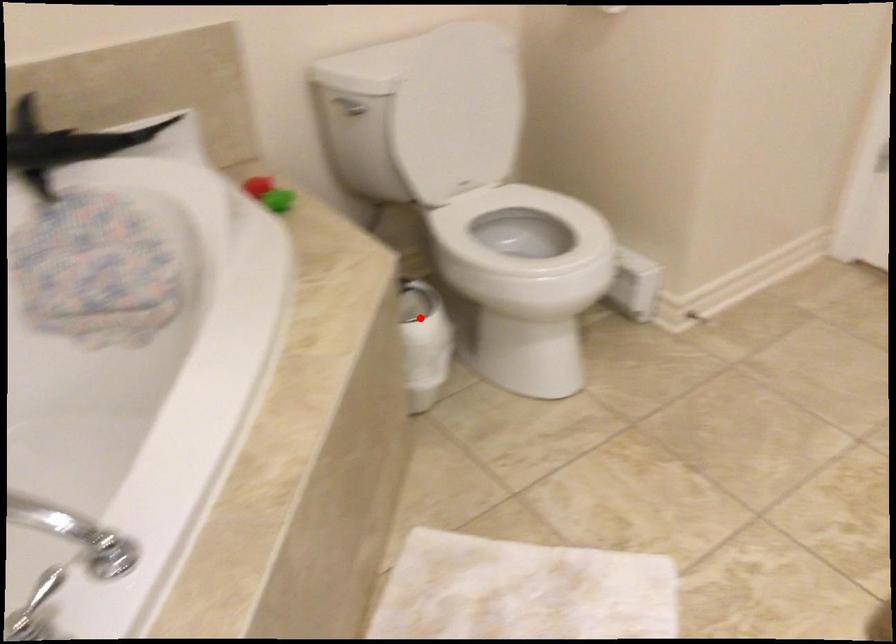
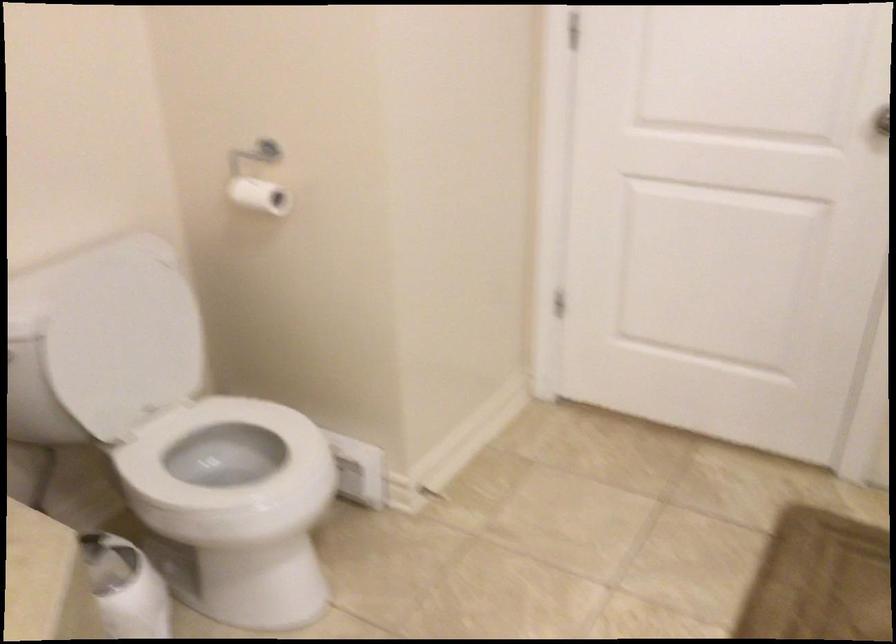
Find the pixel in the second image that matches the highlighted location in the first image.

(125, 587)